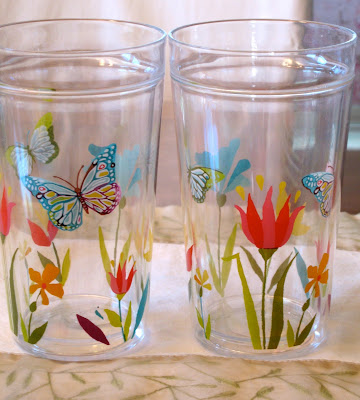
This screenshot has width=360, height=400. Identify the location of cup. (96, 260), (226, 288).